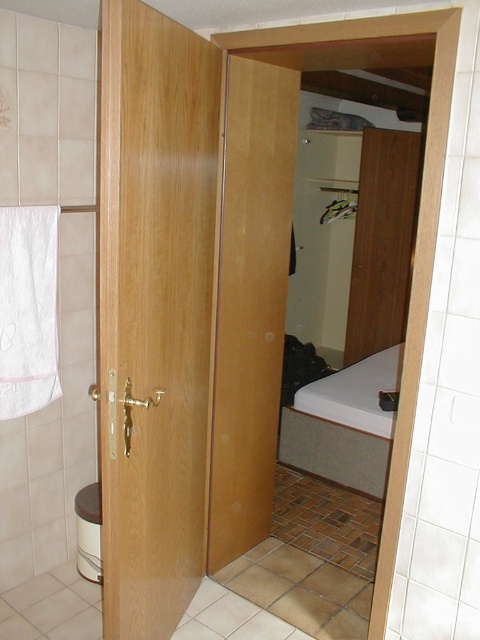
Is light brown wood door at center further to camera compared to white glossy toilet bowl at lower left?

No.

Can you confirm if light brown wood door at center is taller than white glossy toilet bowl at lower left?

Correct, light brown wood door at center is much taller as white glossy toilet bowl at lower left.

Locate an element on the screen. light brown wood door at center is located at coordinates (154, 310).

Locate an element on the screen. light brown wood door at center is located at coordinates (154, 310).

Does light brown wood door at center appear over wooden door at center?

Incorrect, light brown wood door at center is not positioned above wooden door at center.

Which is behind, point (106, 56) or point (241, 529)?

The point (241, 529) is more distant.

What do you see at coordinates (154, 310) in the screenshot?
I see `light brown wood door at center` at bounding box center [154, 310].

The height and width of the screenshot is (640, 480). Find the location of `light brown wood door at center`. light brown wood door at center is located at coordinates (154, 310).

Consider the image. Does wooden door at center appear on the left side of white glossy toilet bowl at lower left?

Incorrect, wooden door at center is not on the left side of white glossy toilet bowl at lower left.

Between wooden door at center and white glossy toilet bowl at lower left, which one is positioned higher?

wooden door at center

Locate an element on the screen. The width and height of the screenshot is (480, 640). wooden door at center is located at coordinates (250, 301).